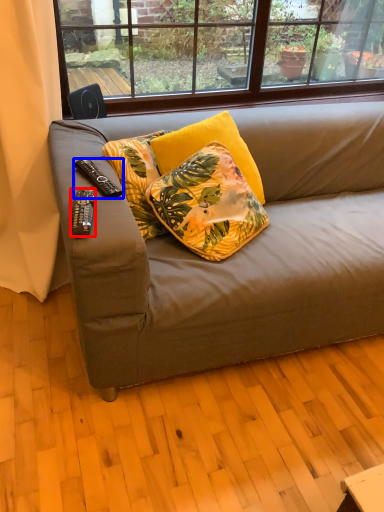
Question: Which of the following is the farthest to the observer, remote control (highlighted by a red box) or remote control (highlighted by a blue box)?

Choices:
 (A) remote control
 (B) remote control

Answer: (B)